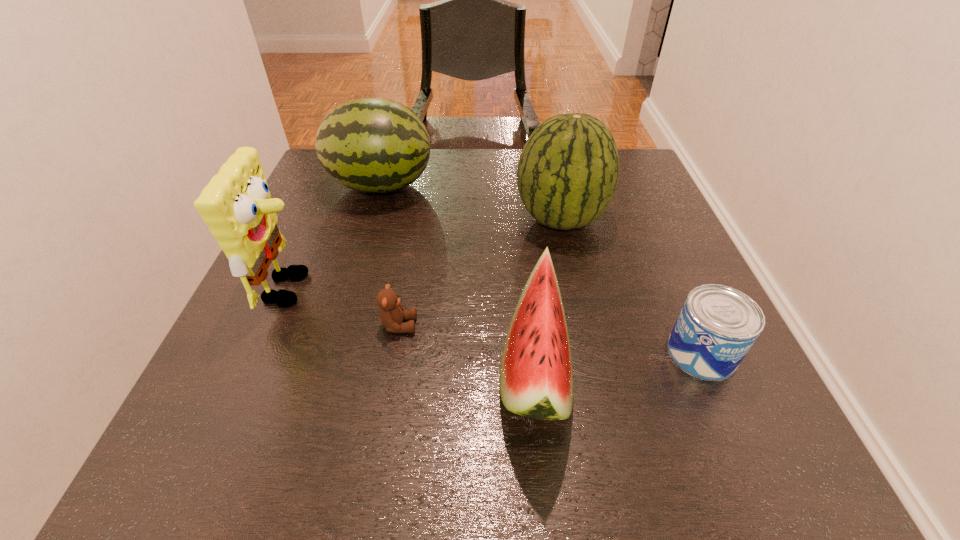
At what (x,y) coordinates should I click in order to perform the action: click on object present at the far right corner. Please return your answer as a coordinate pair (x, y). Looking at the image, I should click on (567, 174).

Locate an element on the screen. The height and width of the screenshot is (540, 960). free region at the far edge of the desktop is located at coordinates (494, 165).

Locate an element on the screen. This screenshot has height=540, width=960. vacant region at the near edge is located at coordinates (389, 477).

The height and width of the screenshot is (540, 960). In the image, there is a desktop. Find the location of `vacant space at the left edge`. vacant space at the left edge is located at coordinates (281, 312).

Identify the location of vacant space at the right edge of the desktop. The image size is (960, 540). (654, 238).

Image resolution: width=960 pixels, height=540 pixels. In the image, there is a desktop. Identify the location of vacant space at the near left corner. (263, 483).

This screenshot has width=960, height=540. I want to click on vacant space at the near right corner of the desktop, so click(691, 452).

The height and width of the screenshot is (540, 960). Identify the location of free spot between the sponge and the teddy bear. (x=345, y=307).

You are a GUI agent. You are given a task and a screenshot of the screen. Output one action in this format:
    pyautogui.click(x=<x>, y=<y>)
    Task: Click on the empty location between the sponge and the leftmost watermelon
    The image size is (960, 540).
    Given the screenshot: What is the action you would take?
    pyautogui.click(x=336, y=237)

Locate an element on the screen. Image resolution: width=960 pixels, height=540 pixels. vacant area that lies between the sponge and the shortest object is located at coordinates (345, 307).